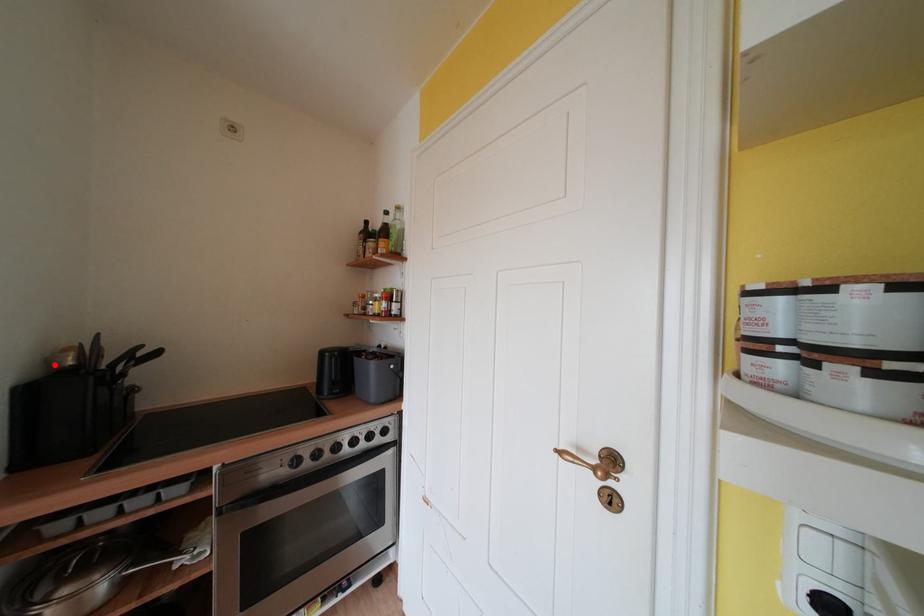
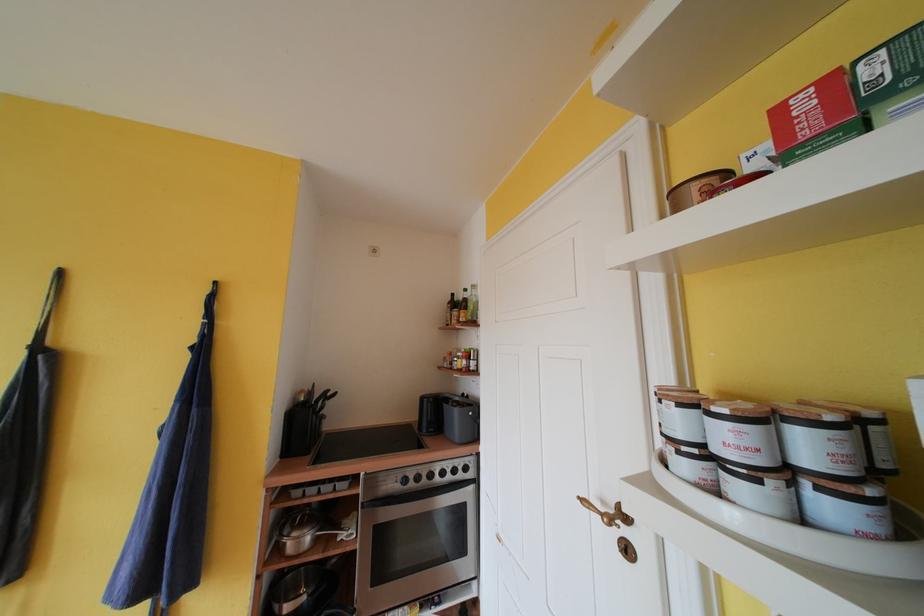
In the second image, find the point that corresponds to the highlighted location in the first image.

(301, 402)